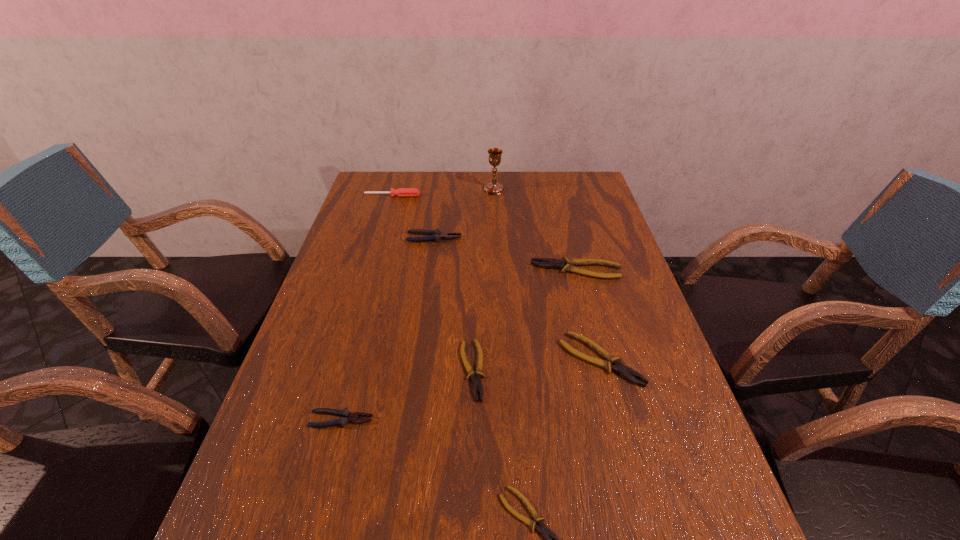
Image resolution: width=960 pixels, height=540 pixels. I want to click on free spot between the red screwdriver and the third smallest yellow pliers, so click(496, 278).

At what (x,y) coordinates should I click in order to perform the action: click on free space between the biggest yellow pliers and the smaller gray pliers. Please return your answer as a coordinate pair (x, y). This screenshot has width=960, height=540. Looking at the image, I should click on coord(459,345).

Where is `free space between the smaller gray pliers and the farthest yellow pliers`? The width and height of the screenshot is (960, 540). free space between the smaller gray pliers and the farthest yellow pliers is located at coordinates (459, 345).

You are a GUI agent. You are given a task and a screenshot of the screen. Output one action in this format:
    pyautogui.click(x=<x>, y=<y>)
    Task: Click on the free space that is in between the second biggest yellow pliers and the tallest object
    This screenshot has height=540, width=960.
    Given the screenshot: What is the action you would take?
    pyautogui.click(x=547, y=274)

You are a GUI agent. You are given a task and a screenshot of the screen. Output one action in this format:
    pyautogui.click(x=<x>, y=<y>)
    Task: Click on the vacant area between the fifth nearest pliers and the smaller gray pliers
    This screenshot has height=540, width=960.
    Given the screenshot: What is the action you would take?
    pyautogui.click(x=459, y=345)

Where is `free space between the second shortest pliers and the chalice`? free space between the second shortest pliers and the chalice is located at coordinates (483, 280).

What are the coordinates of `empty space that is in between the tallest object and the smaller gray pliers` in the screenshot? It's located at (418, 305).

Locate an element on the screen. The width and height of the screenshot is (960, 540). object that can be found as the fourth closest to the seventh tallest object is located at coordinates (567, 265).

In order to click on object that ranks as the sixth closest to the tallest object in this screenshot , I will do `click(346, 416)`.

The image size is (960, 540). What are the coordinates of `the closest pliers to the second nearest object` in the screenshot? It's located at (476, 382).